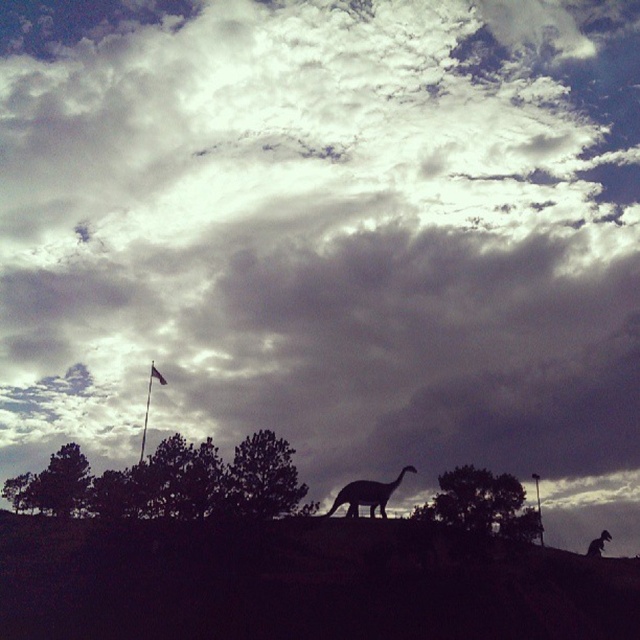
Between dark green leafy trees at lower center and green leafy tree at lower left, which one has more height?

With more height is dark green leafy trees at lower center.

Who is more forward, (122, 472) or (67, 445)?

Positioned in front is point (67, 445).

In order to click on dark green leafy trees at lower center in this screenshot , I will do `click(168, 483)`.

Looking at this image, is silhouette rock at center taller than dark green leafy tree at center?

Indeed, silhouette rock at center has a greater height compared to dark green leafy tree at center.

What do you see at coordinates (300, 582) in the screenshot?
I see `silhouette rock at center` at bounding box center [300, 582].

Which is in front, point (61, 636) or point (276, 490)?

Positioned in front is point (61, 636).

Identify the location of silhouette rock at center. This screenshot has width=640, height=640. (x=300, y=582).

Can you confirm if silhouette matte dinosaur at center is positioned to the right of silhouette dinosaur at center?

In fact, silhouette matte dinosaur at center is to the left of silhouette dinosaur at center.

Between silhouette matte dinosaur at center and silhouette dinosaur at center, which one appears on the right side from the viewer's perspective?

Positioned to the right is silhouette dinosaur at center.

Who is more distant from viewer, [360,483] or [595,554]?

The point [360,483] is more distant.

At what (x,y) coordinates should I click in order to perform the action: click on silhouette matte dinosaur at center. Please return your answer as a coordinate pair (x, y). Looking at the image, I should click on (368, 493).